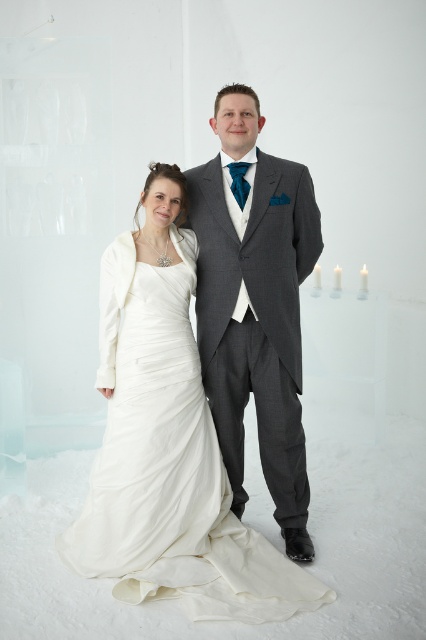
You are a photographer preparing to take a portrait of the couple. You need to ensure that both the ivory satin dress at center and the satin white dress at center are clearly visible in the frame. Which dress should you focus on first to ensure proper alignment?

The ivory satin dress at center is positioned on the right side of the satin white dress at center. Therefore, you should focus on the satin white dress at center first since it is on the left, ensuring both dresses are aligned properly in the frame.

You are a photographer preparing to take a full body portrait of the couple. The camera frame requires both the satin white dress at center and the gray wool suit at center to be fully visible from head to toe. Based on their heights, will you need to adjust the camera angle to ensure both are fully captured?

The satin white dress at center is shorter than the gray wool suit at center, so the photographer does not need to adjust the camera angle. The shorter height of the dress means the camera can capture both fully without any adjustments.